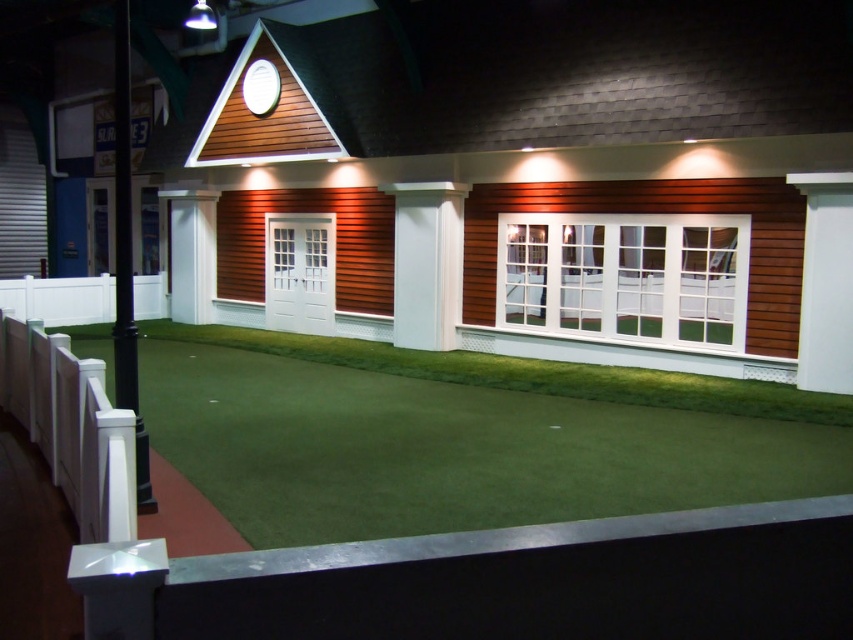
You are a visitor standing in front of the miniature house model. You see the green artificial turf at center and the white smooth column at center. Which object is closer to you?

The green artificial turf at center is closer to you because it is in front of the white smooth column at center.

You are a toy dog that is 10 cm tall. You want to play in the area between the green artificial turf at center and the white smooth column at center. Can you fit through the space between them?

The green artificial turf at center is larger in size than the white smooth column at center, but the description does not provide specific measurements of the space between them. Therefore, it is unclear if the toy dog can fit through the space between them.